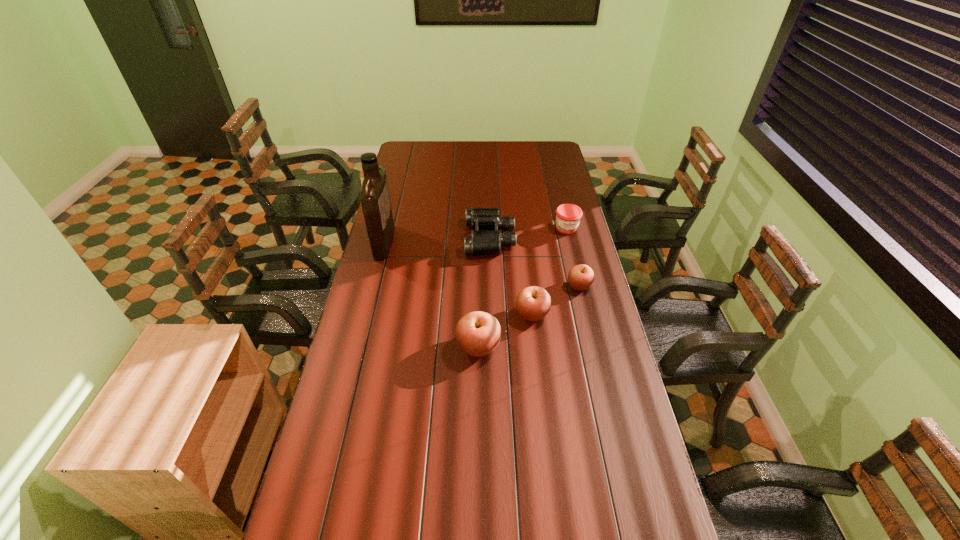
Find the location of a particular element. This screenshot has height=540, width=960. jam present at the right edge is located at coordinates (568, 216).

Identify the location of free space at the far edge. (444, 148).

You are a GUI agent. You are given a task and a screenshot of the screen. Output one action in this format:
    pyautogui.click(x=<x>, y=<y>)
    Task: Click on the free location at the near edge of the desktop
    
    Given the screenshot: What is the action you would take?
    pos(526,484)

This screenshot has width=960, height=540. In the image, there is a desktop. Identify the location of free space at the left edge. (366, 397).

Image resolution: width=960 pixels, height=540 pixels. Find the location of `vacant region at the right edge of the desktop`. vacant region at the right edge of the desktop is located at coordinates (552, 187).

This screenshot has width=960, height=540. What are the coordinates of `free spot between the shortest apple and the jam` in the screenshot? It's located at tap(573, 257).

You are a GUI agent. You are given a task and a screenshot of the screen. Output one action in this format:
    pyautogui.click(x=<x>, y=<y>)
    Task: Click on the free spot between the leftmost object and the binoculars
    
    Given the screenshot: What is the action you would take?
    pyautogui.click(x=437, y=240)

You are a GUI agent. You are given a task and a screenshot of the screen. Output one action in this format:
    pyautogui.click(x=<x>, y=<y>)
    Task: Click on the vacant area between the liquor and the leftmost apple
    The image size is (960, 540).
    Given the screenshot: What is the action you would take?
    pyautogui.click(x=431, y=295)

The width and height of the screenshot is (960, 540). Find the location of `vacant space that's between the binoculars and the liquor`. vacant space that's between the binoculars and the liquor is located at coordinates (437, 240).

Locate an element on the screen. The image size is (960, 540). empty space between the liquor and the binoculars is located at coordinates (437, 240).